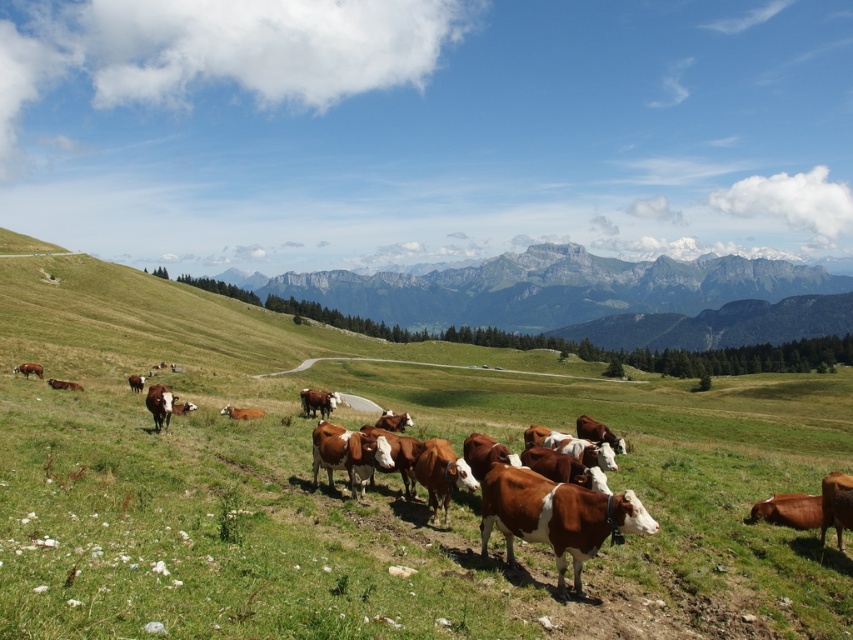
Describe the element at coordinates (375, 483) in the screenshot. I see `green grassy field at center` at that location.

Which is in front, point (126, 292) or point (756, 275)?

Positioned in front is point (126, 292).

This screenshot has height=640, width=853. What are the coordinates of `green grassy field at center` in the screenshot? It's located at (375, 483).